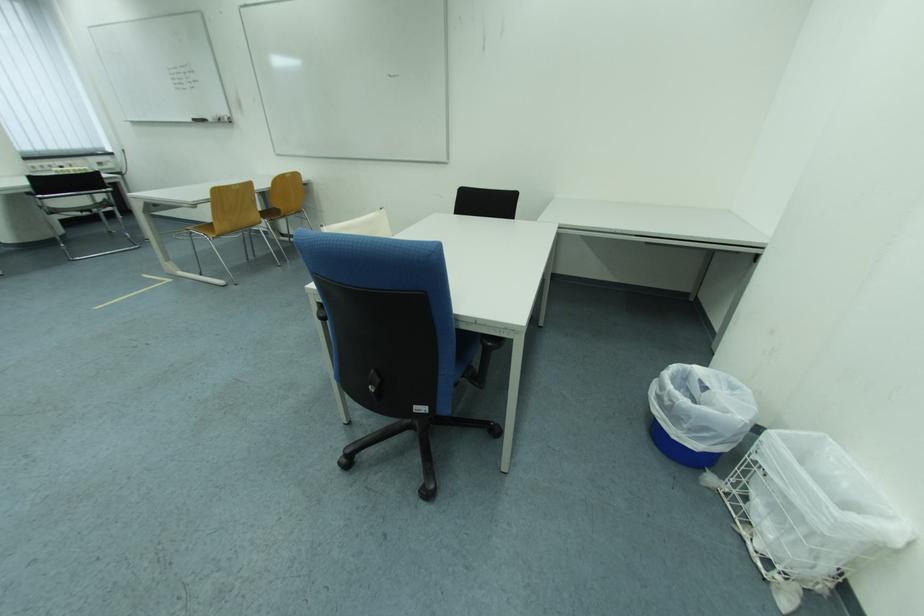
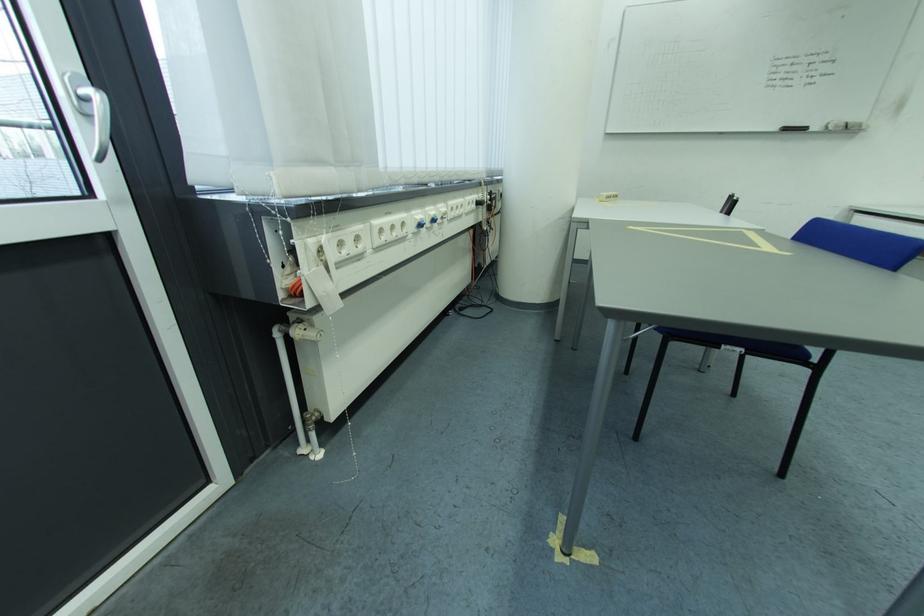
Where in the second image is the point corresponding to pixel 203 123 from the first image?

(796, 131)